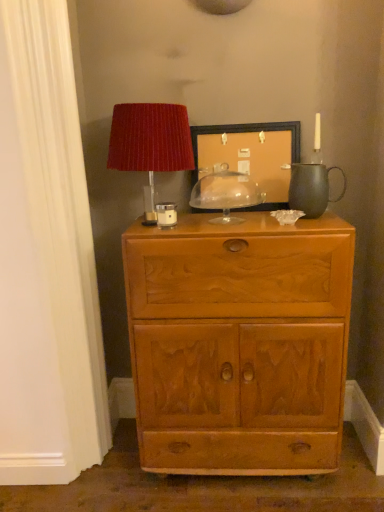
Identify the location of vacant space that is to the left of matte white candle holder at upper center, the 2th candle holder from the right. Image resolution: width=384 pixels, height=512 pixels. (145, 226).